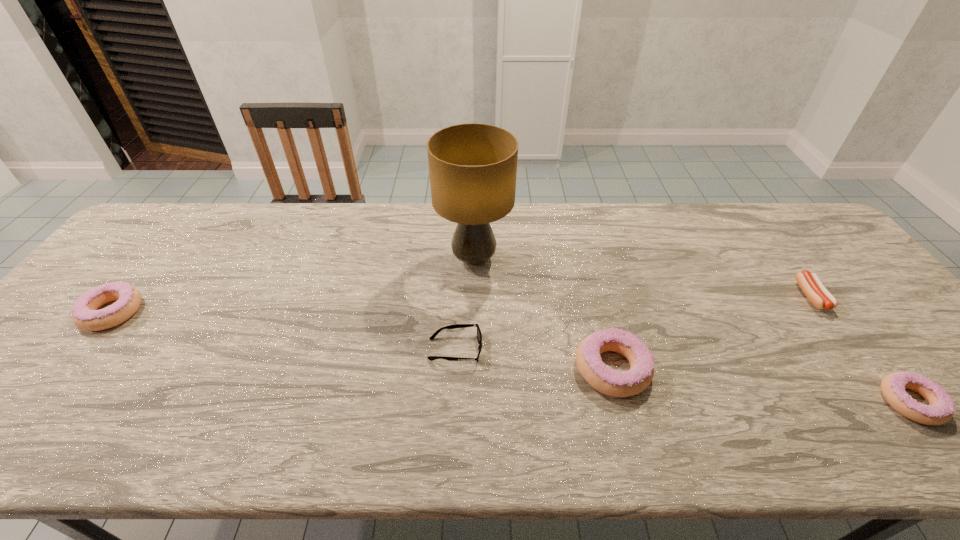
Please determine a free point for an extra doughnut to ensure balance. Please provide its 2D coordinates. Your answer should be formatted as a tuple, i.e. [(x, y)], where the tuple contains the x and y coordinates of a point satisfying the conditions above.

[(348, 339)]